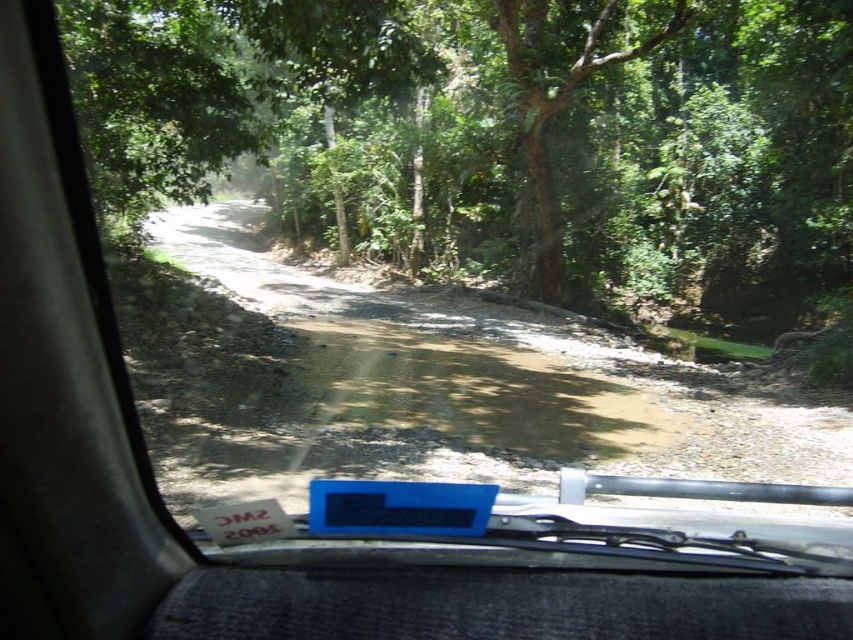
Is green leafy tree at center to the left of brown gravel dirt track at center from the viewer's perspective?

Indeed, green leafy tree at center is positioned on the left side of brown gravel dirt track at center.

Between green leafy tree at center and brown gravel dirt track at center, which one is positioned lower?

brown gravel dirt track at center is below.

Is point (166, 97) behind point (404, 353)?

That is False.

You are a GUI agent. You are given a task and a screenshot of the screen. Output one action in this format:
    pyautogui.click(x=<x>, y=<y>)
    Task: Click on the green leafy tree at center
    
    Given the screenshot: What is the action you would take?
    pyautogui.click(x=502, y=132)